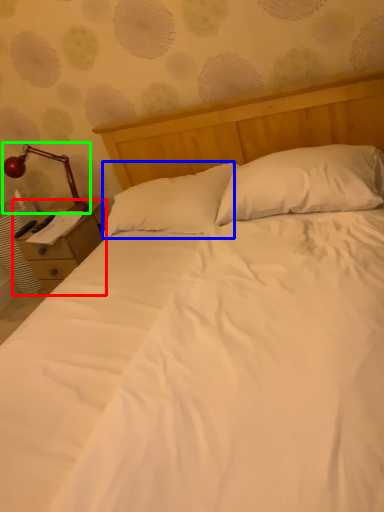
Question: Which is farther away from nightstand (highlighted by a red box)? pillow (highlighted by a blue box) or lamp (highlighted by a green box)?

Choices:
 (A) pillow
 (B) lamp

Answer: (A)